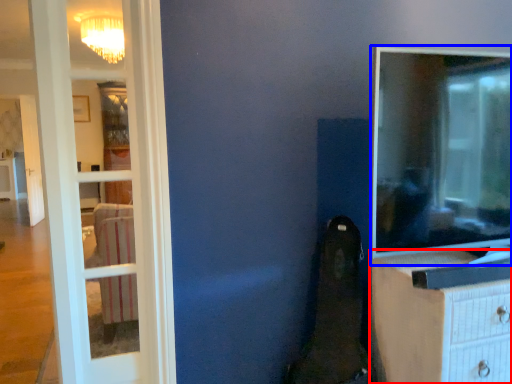
Question: Which object appears farthest to the camera in this image, chest of drawers (highlighted by a red box) or tv show (highlighted by a blue box)?

Choices:
 (A) chest of drawers
 (B) tv show

Answer: (B)